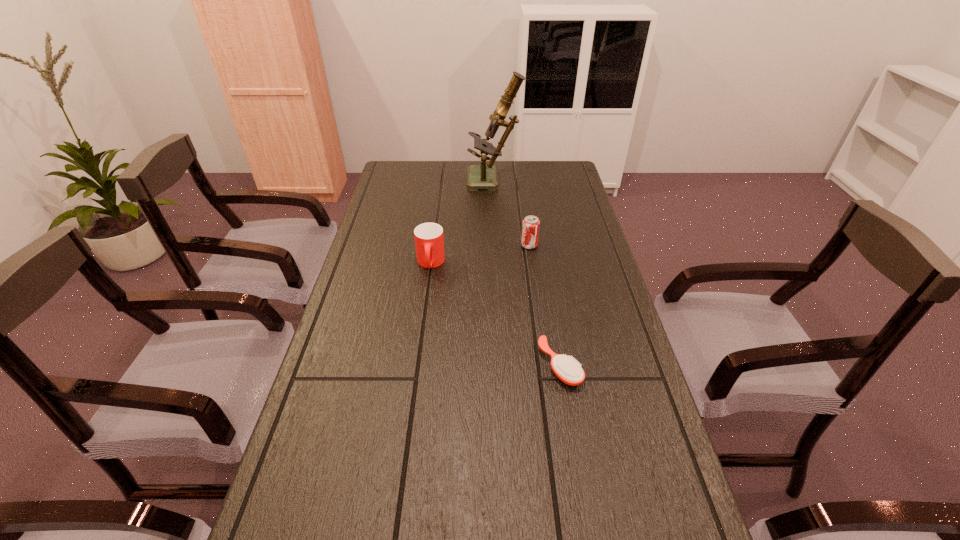
Where is `vacant space that satisfies the following two spatial constraints: 1. at the eyepiece of the farthest object; 2. on the right side of the second farthest object`? The width and height of the screenshot is (960, 540). vacant space that satisfies the following two spatial constraints: 1. at the eyepiece of the farthest object; 2. on the right side of the second farthest object is located at coordinates (496, 245).

Identify the location of vacant position in the image that satisfies the following two spatial constraints: 1. on the side of the shortest object with the handle; 2. on the right side of the leftmost object. Image resolution: width=960 pixels, height=540 pixels. (417, 365).

At what (x,y) coordinates should I click in order to perform the action: click on free space that satisfies the following two spatial constraints: 1. on the back side of the soda can; 2. at the eyepiece of the tallest object. Please return your answer as a coordinate pair (x, y). Looking at the image, I should click on (520, 182).

The height and width of the screenshot is (540, 960). I want to click on free point that satisfies the following two spatial constraints: 1. at the eyepiece of the farthest object; 2. on the left side of the third nearest object, so click(x=496, y=245).

I want to click on free space that satisfies the following two spatial constraints: 1. on the side of the leftmost object with the handle; 2. on the right side of the shortest object, so (x=417, y=365).

At what (x,y) coordinates should I click in order to perform the action: click on vacant area in the image that satisfies the following two spatial constraints: 1. on the side of the nearest object with the handle; 2. on the left side of the cup. Please return your answer as a coordinate pair (x, y). This screenshot has height=540, width=960. Looking at the image, I should click on (417, 365).

Where is `free spot that satisfies the following two spatial constraints: 1. on the back side of the shortest object; 2. at the eyepiece of the microscope`? This screenshot has width=960, height=540. free spot that satisfies the following two spatial constraints: 1. on the back side of the shortest object; 2. at the eyepiece of the microscope is located at coordinates (529, 182).

What are the coordinates of `vacant space that satisfies the following two spatial constraints: 1. on the side of the leftmost object with the handle; 2. on the right side of the hairbrush` in the screenshot? It's located at (x=417, y=365).

I want to click on free location that satisfies the following two spatial constraints: 1. at the eyepiece of the microscope; 2. on the back side of the soda can, so click(496, 245).